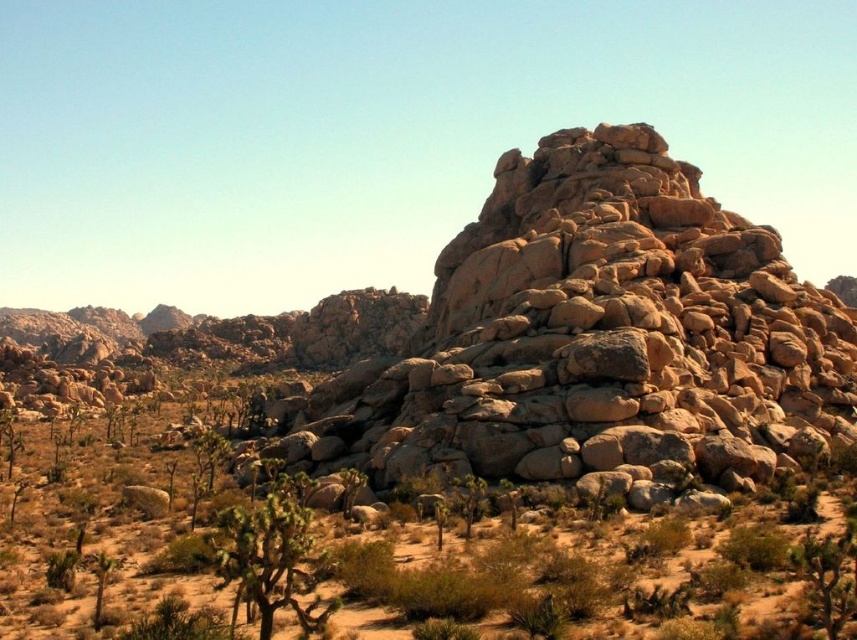
From the picture: You are a hiker navigating through the desert and you see the rustic stone boulder at center and the green leafy bush at lower center. Which object is located higher in the scene?

The rustic stone boulder at center is positioned over the green leafy bush at lower center, so it is higher in the scene.

You are standing in the desert looking at the rustic stone boulder at center and the green leafy bush at center. Which object is closer to you?

The rustic stone boulder at center is closer to you because it is further to the viewer than the green leafy bush at center.